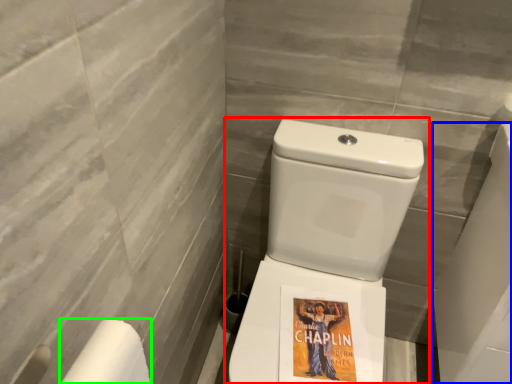
Question: Based on their relative distances, which object is farther from toilet (highlighted by a red box)? Choose from porcelain (highlighted by a blue box) and toilet paper (highlighted by a green box).

Choices:
 (A) porcelain
 (B) toilet paper

Answer: (B)